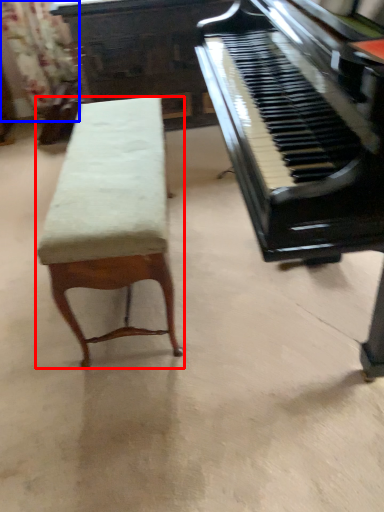
Question: Which point is closer to the camera, furniture (highlighted by a red box) or curtain (highlighted by a blue box)?

Choices:
 (A) furniture
 (B) curtain

Answer: (A)